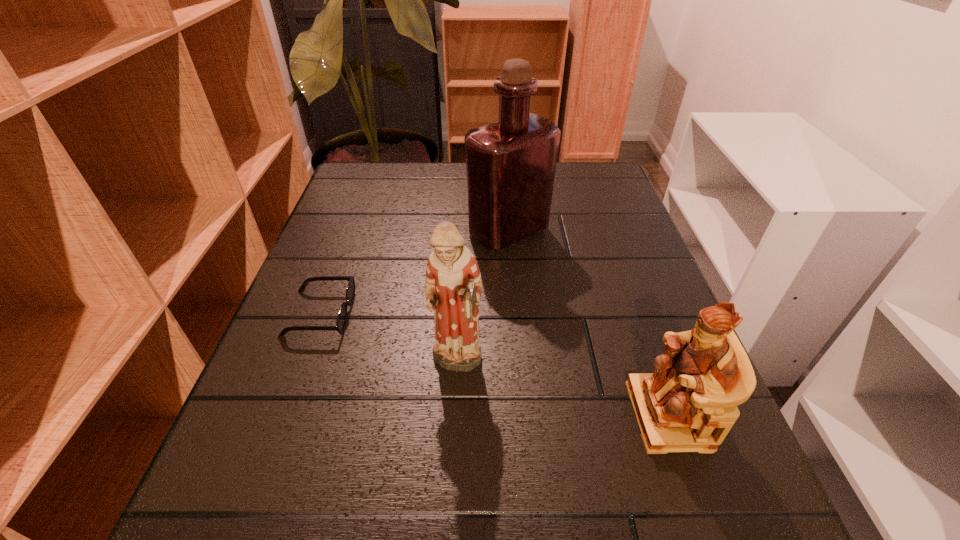
The height and width of the screenshot is (540, 960). Find the location of `free space at the far right corner`. free space at the far right corner is located at coordinates (590, 177).

Locate an element on the screen. The width and height of the screenshot is (960, 540). vacant region between the right figurine and the left figurine is located at coordinates (563, 390).

You are a GUI agent. You are given a task and a screenshot of the screen. Output one action in this format:
    pyautogui.click(x=<x>, y=<y>)
    Task: Click on the empty location between the leftmost object and the rightmost object
    The width and height of the screenshot is (960, 540).
    Given the screenshot: What is the action you would take?
    pyautogui.click(x=494, y=364)

The height and width of the screenshot is (540, 960). I want to click on free spot between the shorter figurine and the farthest object, so click(x=588, y=323).

Where is `free space between the farthest object and the rightmost object`? free space between the farthest object and the rightmost object is located at coordinates (588, 323).

The image size is (960, 540). Find the location of `free spot between the liquor and the second tallest object`. free spot between the liquor and the second tallest object is located at coordinates (482, 298).

The width and height of the screenshot is (960, 540). Find the location of `free spot between the farthest object and the third shortest object`. free spot between the farthest object and the third shortest object is located at coordinates (482, 298).

Identify the location of free space that is in between the taller figurine and the third tallest object. pyautogui.click(x=563, y=390).

Identify the location of free space that is in between the shorter figurine and the shortest object. (494, 364).

Where is `free spot between the left figurine and the third nearest object`? The image size is (960, 540). free spot between the left figurine and the third nearest object is located at coordinates (388, 339).